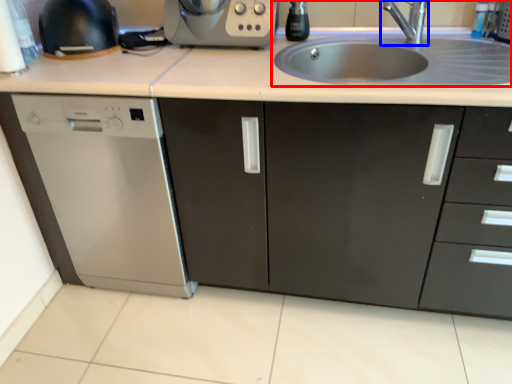
Question: Which object appears farthest to the camera in this image, sink (highlighted by a red box) or tap (highlighted by a blue box)?

Choices:
 (A) sink
 (B) tap

Answer: (B)